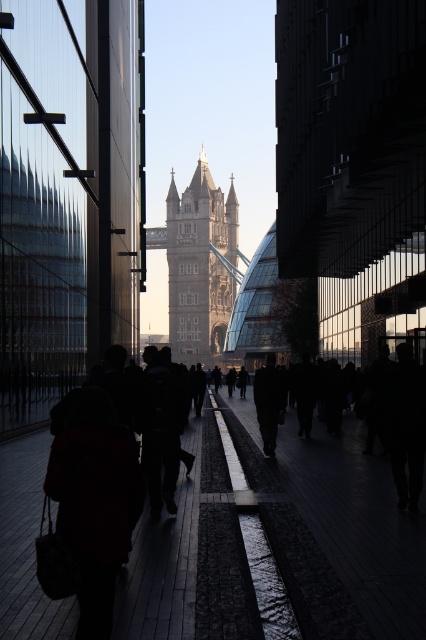
Does stone tower at center have a smaller size compared to dark fabric coat at center?

No, stone tower at center is not smaller than dark fabric coat at center.

Which is more to the right, stone tower at center or dark fabric coat at center?

dark fabric coat at center is more to the right.

Which is in front, point (175, 326) or point (273, 456)?

Point (273, 456) is in front.

The image size is (426, 640). I want to click on stone tower at center, so click(x=199, y=262).

Does point (92, 580) come closer to viewer compared to point (198, 180)?

Yes, it is in front of point (198, 180).

Does dark red coat at center have a greater width compared to stone tower at center?

No, dark red coat at center is not wider than stone tower at center.

Find the location of a particular element. dark red coat at center is located at coordinates (94, 499).

Does dark gray concrete pavement at center appear on the left side of dark red coat at center?

Incorrect, dark gray concrete pavement at center is not on the left side of dark red coat at center.

Identify the location of dark gray concrete pavement at center. This screenshot has height=640, width=426. (334, 531).